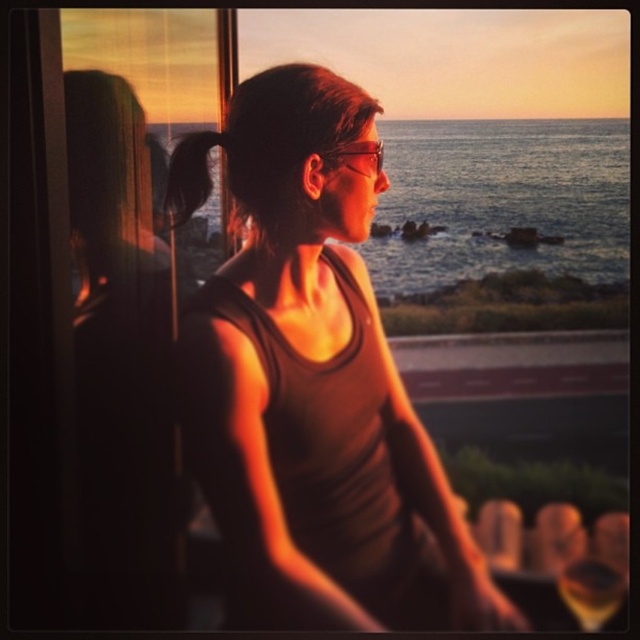
Is point (221, 205) farther from viewer compared to point (333, 148)?

Yes.

What are the coordinates of `black hair at upper left` in the screenshot? It's located at (188, 176).

Is point (124, 257) less distant than point (348, 152)?

Yes, it is.

What do you see at coordinates (122, 362) in the screenshot? I see `matte black hair at left` at bounding box center [122, 362].

Which is behind, point (148, 468) or point (349, 145)?

The point (148, 468) is more distant.

The width and height of the screenshot is (640, 640). What are the coordinates of `matte black hair at left` in the screenshot? It's located at (122, 362).

Who is positioned more to the left, matte brown tank top at center or matte black goggles at center?

From the viewer's perspective, matte brown tank top at center appears more on the left side.

Is point (369, 490) closer to camera compared to point (380, 141)?

No, it is behind (380, 141).

The height and width of the screenshot is (640, 640). Describe the element at coordinates (316, 392) in the screenshot. I see `matte brown tank top at center` at that location.

Find the location of a particular element. This screenshot has width=640, height=640. matte brown tank top at center is located at coordinates (316, 392).